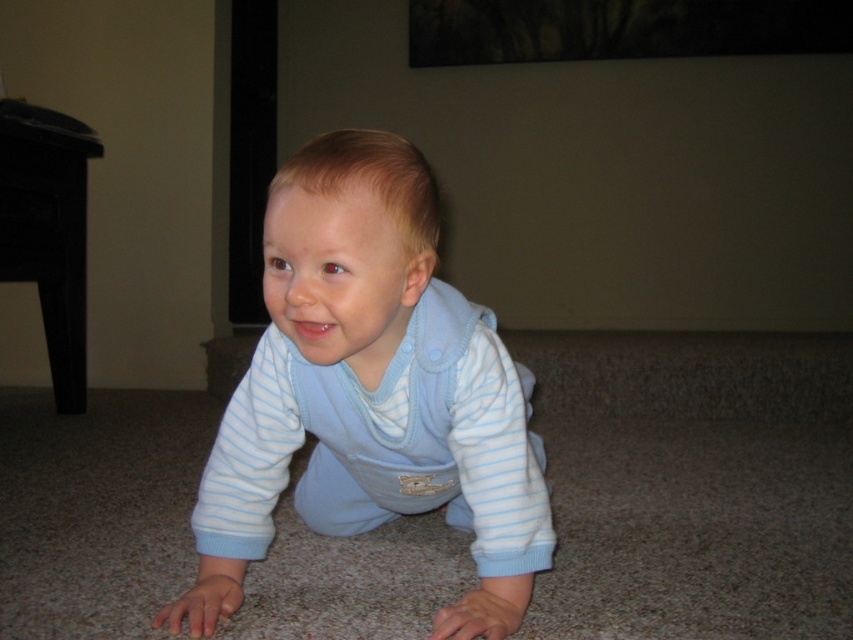
Is the position of light blue soft fabric baby at center less distant than that of black wood table at left?

Yes, it is.

Can you confirm if light blue soft fabric baby at center is shorter than black wood table at left?

Yes.

You are a GUI agent. You are given a task and a screenshot of the screen. Output one action in this format:
    pyautogui.click(x=<x>, y=<y>)
    Task: Click on the light blue soft fabric baby at center
    This screenshot has height=640, width=853.
    Given the screenshot: What is the action you would take?
    pyautogui.click(x=369, y=390)